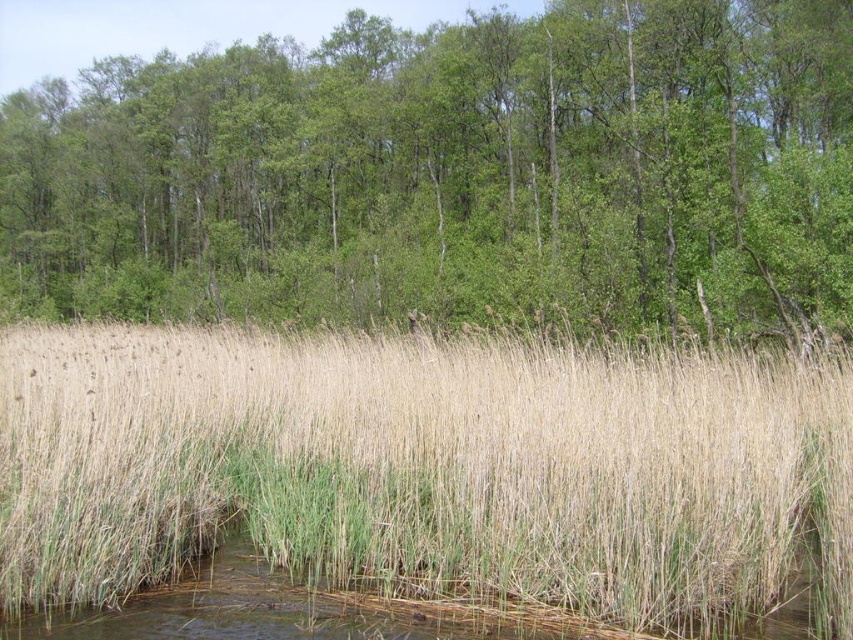
Question: Which point appears farthest from the camera in this image?

Choices:
 (A) (152, 579)
 (B) (372, 188)

Answer: (B)

Question: Does green leafy trees at upper center appear on the right side of dry grass at center?

Choices:
 (A) yes
 (B) no

Answer: (B)

Question: Observing the image, what is the correct spatial positioning of green leafy trees at upper center in reference to dry grass at center?

Choices:
 (A) below
 (B) above

Answer: (B)

Question: Is green leafy trees at upper center thinner than dry grass at center?

Choices:
 (A) no
 (B) yes

Answer: (A)

Question: Which of the following is the closest to the observer?

Choices:
 (A) green leafy trees at upper center
 (B) dry grass at center

Answer: (B)